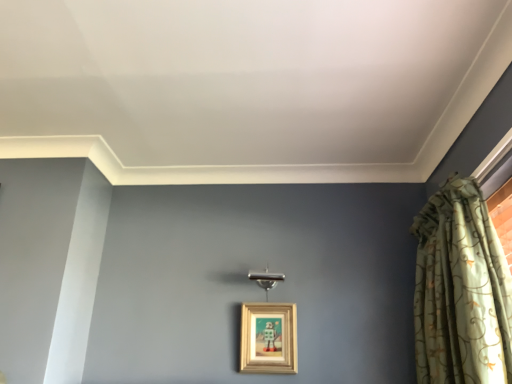
Question: Based on their positions, is green floral fabric curtain at right located to the left or right of wooden frame at center?

Choices:
 (A) right
 (B) left

Answer: (A)

Question: From a real-world perspective, is green floral fabric curtain at right physically located above or below wooden frame at center?

Choices:
 (A) above
 (B) below

Answer: (A)

Question: From the image's perspective, is green floral fabric curtain at right above or below wooden frame at center?

Choices:
 (A) above
 (B) below

Answer: (A)

Question: Considering the positions of wooden frame at center and green floral fabric curtain at right in the image, is wooden frame at center bigger or smaller than green floral fabric curtain at right?

Choices:
 (A) small
 (B) big

Answer: (A)

Question: Considering the positions of wooden frame at center and green floral fabric curtain at right in the image, is wooden frame at center taller or shorter than green floral fabric curtain at right?

Choices:
 (A) tall
 (B) short

Answer: (B)

Question: Visually, is wooden frame at center positioned to the left or to the right of green floral fabric curtain at right?

Choices:
 (A) right
 (B) left

Answer: (B)

Question: Considering the positions of wooden frame at center and green floral fabric curtain at right in the image, is wooden frame at center wider or thinner than green floral fabric curtain at right?

Choices:
 (A) thin
 (B) wide

Answer: (A)